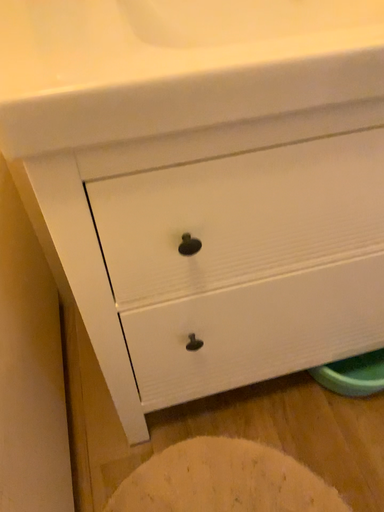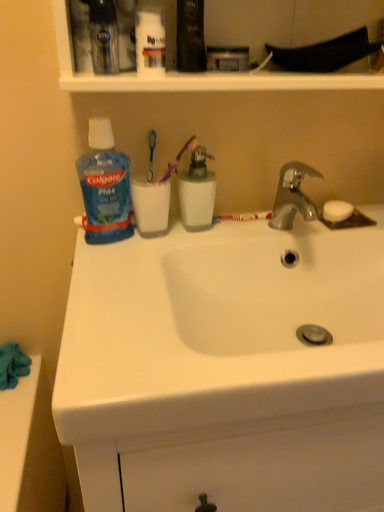
Question: How did the camera likely rotate when shooting the video?

Choices:
 (A) rotated upward
 (B) rotated downward

Answer: (A)